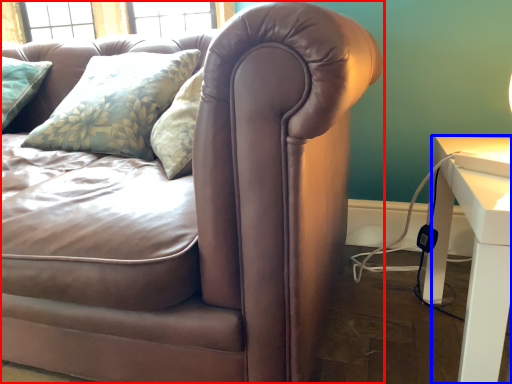
Question: Which point is further to the camera, studio couch (highlighted by a red box) or table (highlighted by a blue box)?

Choices:
 (A) studio couch
 (B) table

Answer: (B)